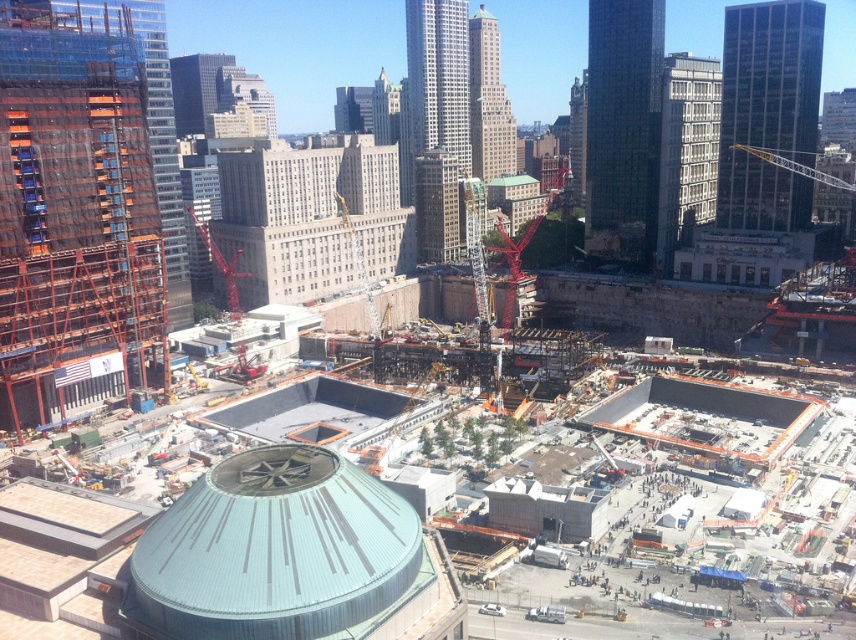
Does gold glass skyscraper at center lie behind gray concrete skyscraper at upper right?

Yes, gold glass skyscraper at center is behind gray concrete skyscraper at upper right.

Can you confirm if gold glass skyscraper at center is positioned below gray concrete skyscraper at upper right?

No, gold glass skyscraper at center is not below gray concrete skyscraper at upper right.

Where is `gold glass skyscraper at center`? The image size is (856, 640). gold glass skyscraper at center is located at coordinates (438, 122).

Is the position of light gray concrete building at upper center less distant than that of red metallic crane at center-left?

No, it is behind red metallic crane at center-left.

Between light gray concrete building at upper center and red metallic crane at center-left, which one is positioned lower?

red metallic crane at center-left is below.

Is point (224, 100) farther from camera compared to point (191, 208)?

Yes, point (224, 100) is farther from viewer.

Locate an element on the screen. The width and height of the screenshot is (856, 640). light gray concrete building at upper center is located at coordinates (245, 93).

Is glassy reflective skyscraper at right positioned before gold glass skyscraper at center?

That is True.

Based on the photo, which of these two, glassy reflective skyscraper at right or gold glass skyscraper at center, stands taller?

gold glass skyscraper at center is taller.

Is point (752, 221) positioned after point (424, 20)?

No.

Where is `glassy reflective skyscraper at right`? This screenshot has height=640, width=856. glassy reflective skyscraper at right is located at coordinates pos(768,113).